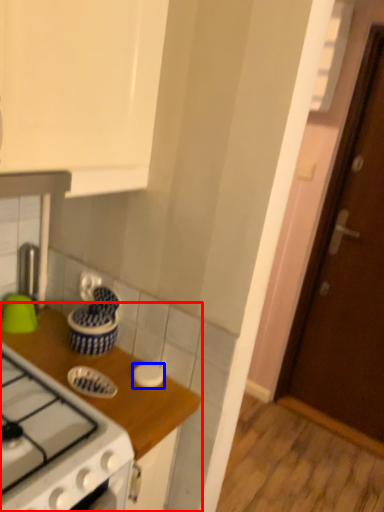
Question: Which object is further to the camera taking this photo, countertop (highlighted by a red box) or kitchen appliance (highlighted by a blue box)?

Choices:
 (A) countertop
 (B) kitchen appliance

Answer: (B)